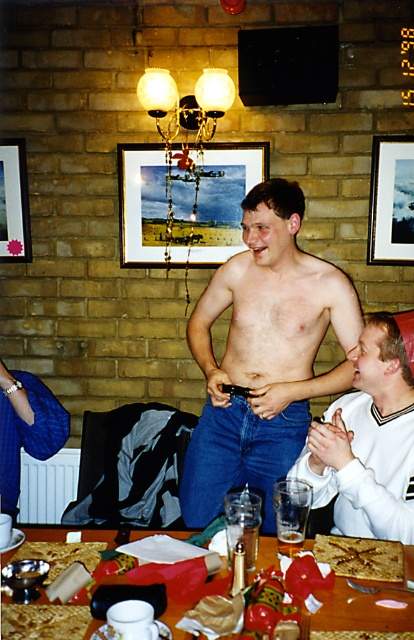
Question: Which of these objects is positioned closest to the smooth white shirt at center?

Choices:
 (A) denim jeans at center
 (B) wooden framed picture at center

Answer: (A)

Question: Is metallic silver picture frame at upper center bigger than brown crumbly cake at center?

Choices:
 (A) yes
 (B) no

Answer: (A)

Question: In this image, where is denim jeans at center located relative to brown crumbly cake at center?

Choices:
 (A) right
 (B) left

Answer: (B)

Question: Does smooth white shirt at center lie behind wooden textured table at center?

Choices:
 (A) no
 (B) yes

Answer: (B)

Question: Which of the following is the closest to the observer?

Choices:
 (A) brown crumbly cake at center
 (B) wooden textured table at center

Answer: (B)

Question: Which object is closer to the camera taking this photo?

Choices:
 (A) brown crumbly cake at center
 (B) smooth white shirt at center
 (C) metallic silver picture frame at upper center
 (D) wooden picture frame at upper left

Answer: (A)